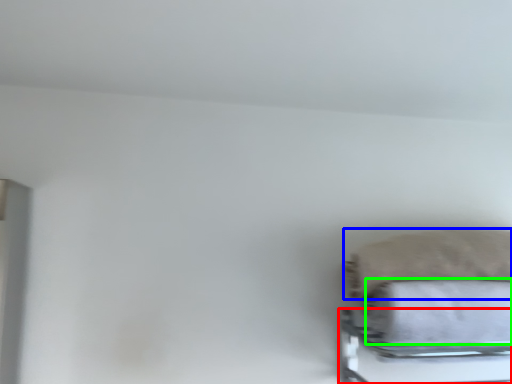
Question: Which is farther away from bed frame (highlighted by a red box)? pillow (highlighted by a blue box) or bath towel (highlighted by a green box)?

Choices:
 (A) pillow
 (B) bath towel

Answer: (A)